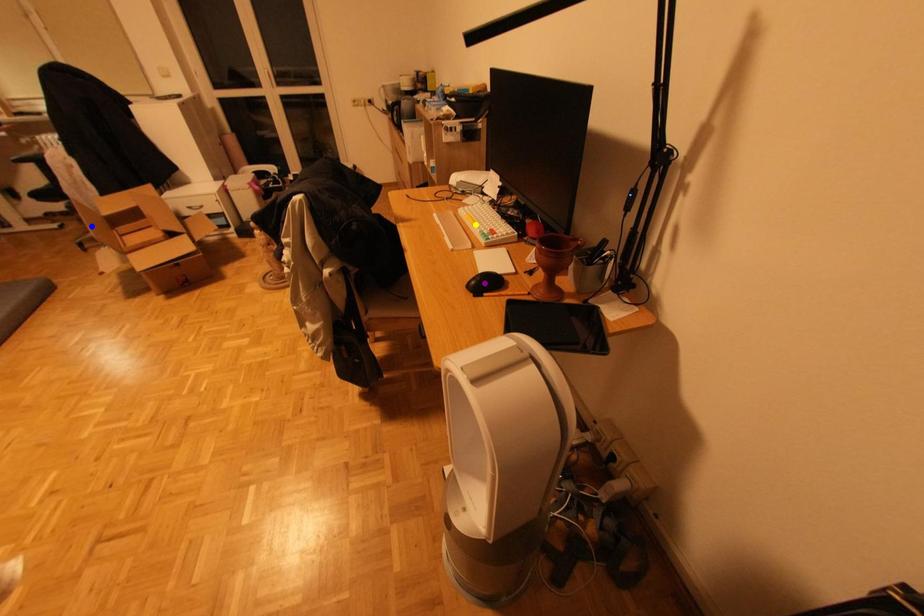
Order these from nearest to farthest:
- yellow point
- purple point
- blue point

1. blue point
2. yellow point
3. purple point